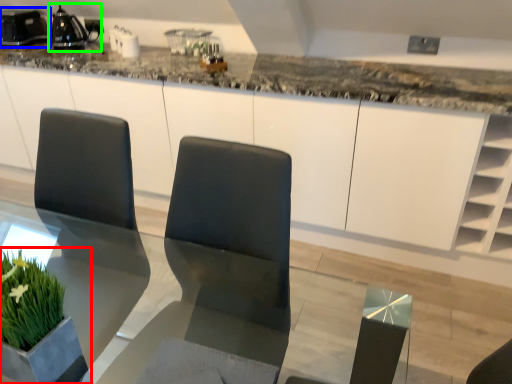
Question: Which object is the farthest from houseplant (highlighted by a red box)? Choose among these: appliance (highlighted by a blue box) or appliance (highlighted by a green box).

Choices:
 (A) appliance
 (B) appliance

Answer: (A)